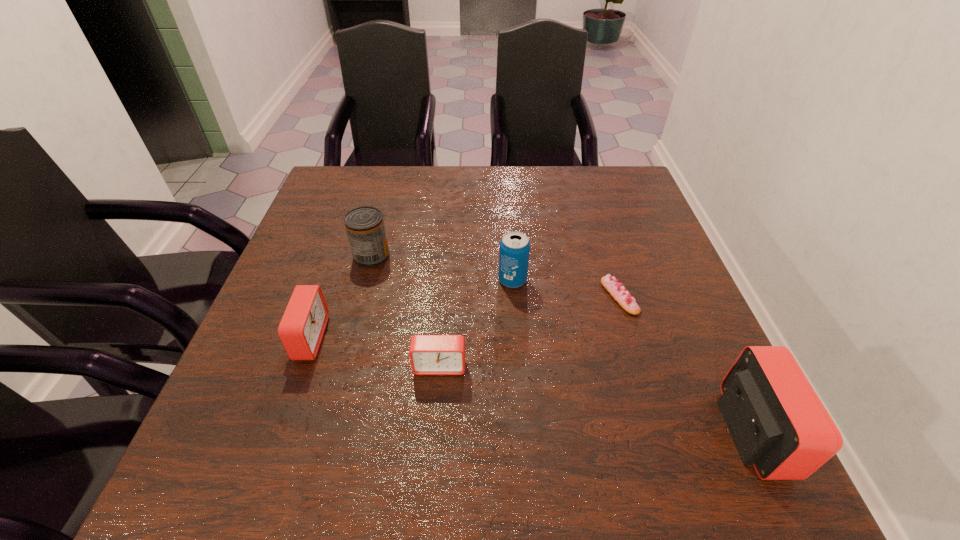
Locate an element on the screen. The width and height of the screenshot is (960, 540). eclair located in the right edge section of the desktop is located at coordinates (617, 291).

You are a GUI agent. You are given a task and a screenshot of the screen. Output one action in this format:
    pyautogui.click(x=<x>, y=<y>)
    Task: Click on the object present at the near right corner
    
    Given the screenshot: What is the action you would take?
    pyautogui.click(x=778, y=424)

Where is `vacant region at the far edge of the desktop`? The image size is (960, 540). vacant region at the far edge of the desktop is located at coordinates (392, 169).

Image resolution: width=960 pixels, height=540 pixels. I want to click on vacant space at the near edge of the desktop, so click(x=634, y=404).

Where is `vacant space at the far left corner of the desktop`? vacant space at the far left corner of the desktop is located at coordinates (335, 197).

The image size is (960, 540). I want to click on free space at the far right corner of the desktop, so click(636, 204).

Find the location of `vacant space at the near right corner`. vacant space at the near right corner is located at coordinates (669, 402).

The image size is (960, 540). I want to click on unoccupied area between the leftmost object and the can, so click(341, 297).

The height and width of the screenshot is (540, 960). What are the coordinates of `empty location between the shortest object and the shortest alarm clock` in the screenshot? It's located at [x=530, y=331].

Identify the location of free space between the soda can and the nearest alarm clock. This screenshot has width=960, height=540. (632, 356).